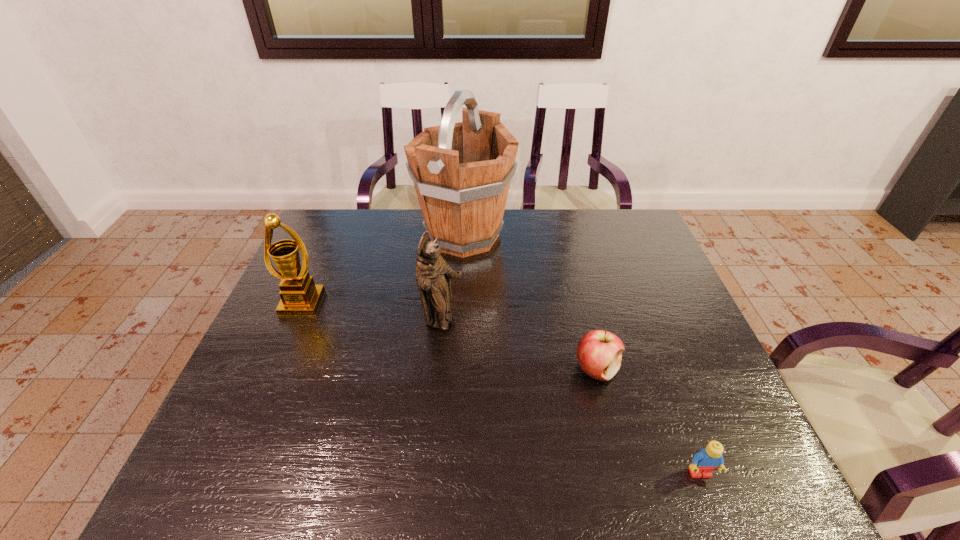
You are a GUI agent. You are given a task and a screenshot of the screen. Output one action in this format:
    pyautogui.click(x=<x>, y=<y>)
    Task: Click on the farthest object
    The image size is (960, 540).
    Given the screenshot: What is the action you would take?
    pyautogui.click(x=461, y=172)

Where is `bucket`? bucket is located at coordinates (461, 172).

Locate an element on the screen. Image resolution: width=960 pixels, height=540 pixels. award is located at coordinates (300, 296).

In order to click on figurine in this screenshot , I will do `click(432, 273)`.

This screenshot has width=960, height=540. In order to click on the fourth object from left to right in this screenshot , I will do `click(599, 352)`.

You are a GUI agent. You are given a task and a screenshot of the screen. Output one action in this format:
    pyautogui.click(x=<x>, y=<y>)
    Task: Click on the fourth farthest object
    
    Given the screenshot: What is the action you would take?
    pyautogui.click(x=599, y=352)

This screenshot has width=960, height=540. What are the coordinates of `the nearest object` in the screenshot? It's located at (708, 459).

The width and height of the screenshot is (960, 540). In order to click on the rightmost object in this screenshot , I will do `click(708, 459)`.

This screenshot has height=540, width=960. I want to click on vacant space located on the right of the tallest object, so click(x=629, y=236).

Image resolution: width=960 pixels, height=540 pixels. I want to click on vacant position located 0.270m on the front-facing side of the leftmost object, so click(258, 404).